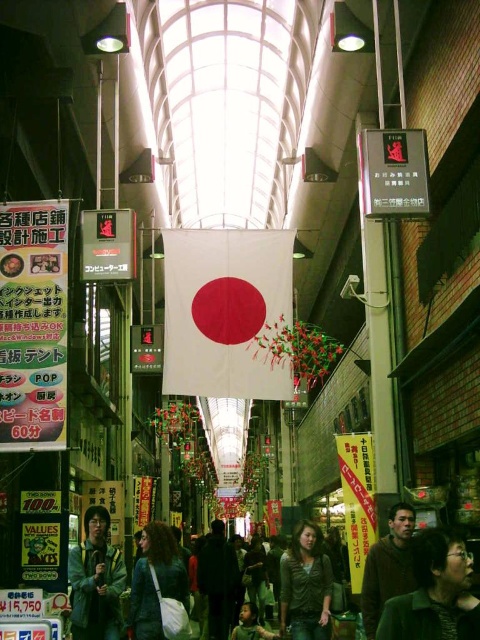
Consider the image. You are standing at the entrance of the shopping arcade and see both the dark green leather jacket at center and the dark gray fabric coat at center. Which item is positioned closer to you?

The dark green leather jacket at center is closer to the viewer than the dark gray fabric coat at center.

You are a customer in the shopping arcade and want to buy a coat. You see both the dark green leather jacket at center and the dark gray fabric coat at center. Which one is smaller in size?

The dark green leather jacket at center is smaller than the dark gray fabric coat at center.